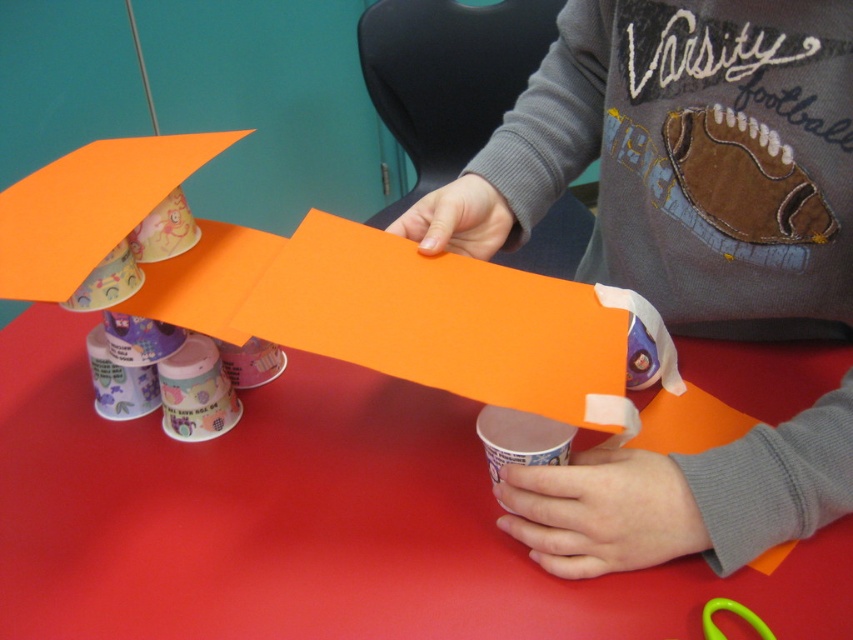
Question: Among these points, which one is farthest from the camera?

Choices:
 (A) (759, 620)
 (B) (241, 598)

Answer: (B)

Question: Does white paper cup at center appear on the left side of green plastic scissors at lower right?

Choices:
 (A) yes
 (B) no

Answer: (A)

Question: Among these points, which one is farthest from the camera?

Choices:
 (A) (740, 611)
 (B) (262, 436)

Answer: (B)

Question: Does red paper table at center have a larger size compared to white paper cup at center?

Choices:
 (A) yes
 (B) no

Answer: (A)

Question: Which object is closer to the camera taking this photo?

Choices:
 (A) green plastic scissors at lower right
 (B) red paper table at center
 (C) white paper cup at center

Answer: (A)

Question: Does red paper table at center appear under green plastic scissors at lower right?

Choices:
 (A) no
 (B) yes

Answer: (A)